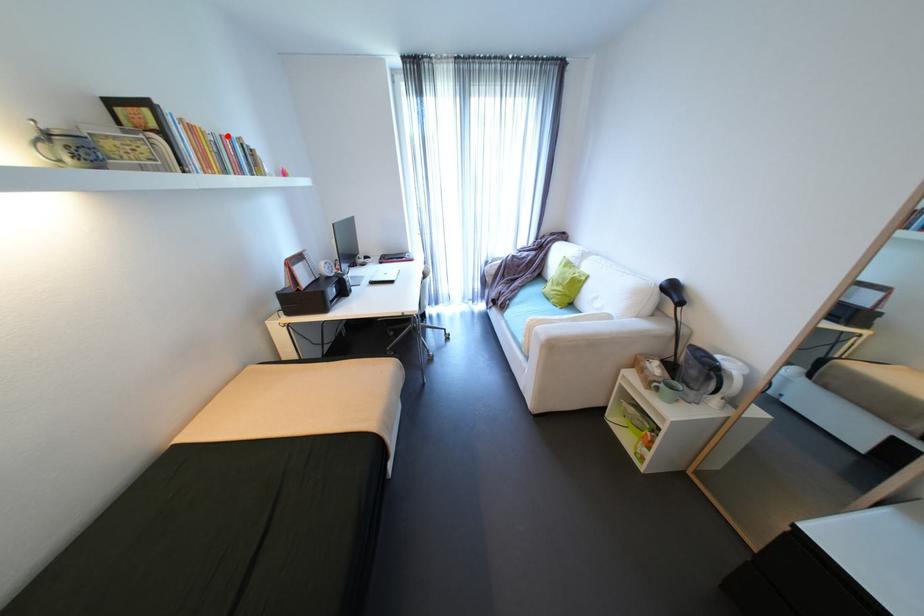
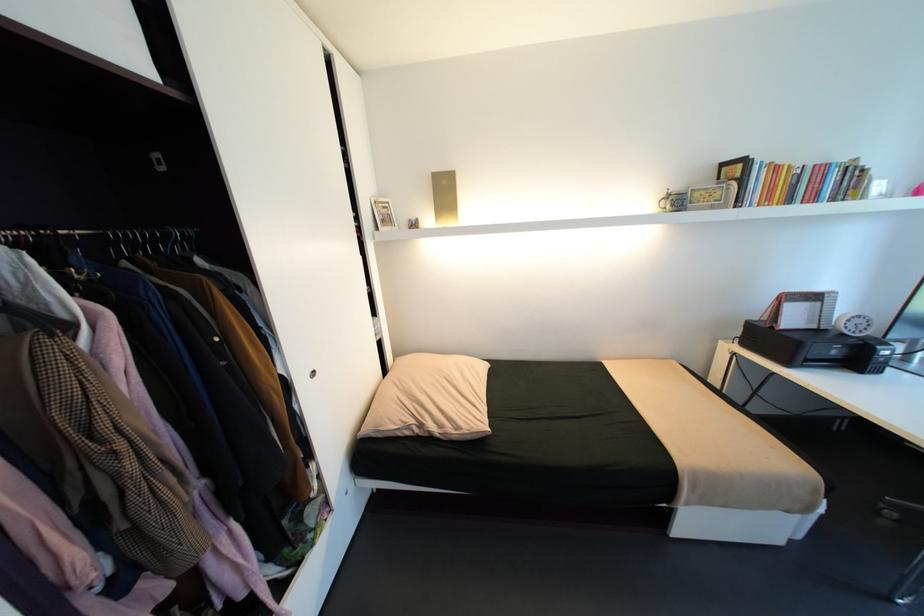
Where in the second image is the point corresponding to the highlighted location from the first image?

(821, 166)